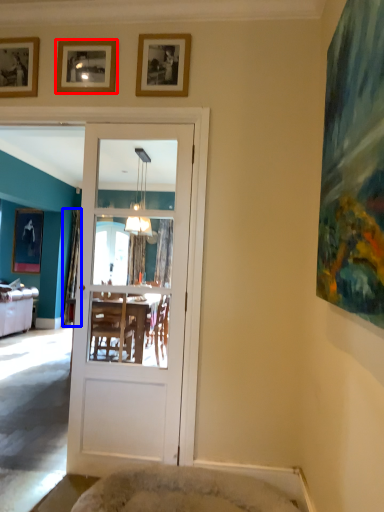
Question: Among these objects, which one is nearest to the camera, picture frame (highlighted by a red box) or curtain (highlighted by a blue box)?

Choices:
 (A) picture frame
 (B) curtain

Answer: (A)